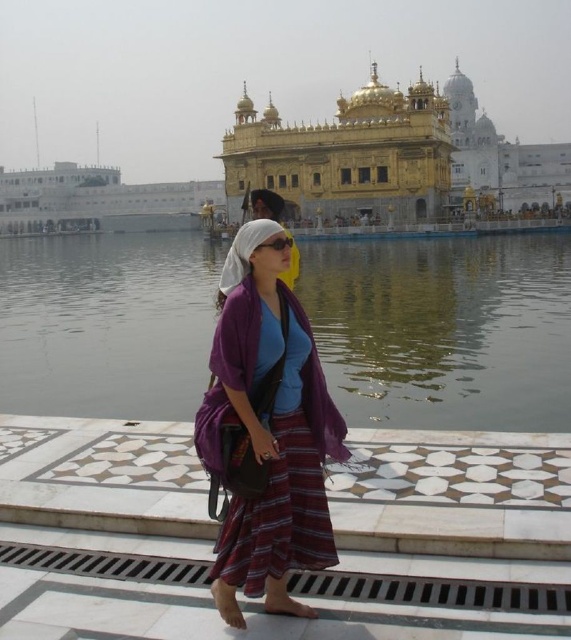
You are a visitor at the Golden Temple and notice the transparent water at center and the purple fabric scarf at center. Which object is taller when viewed from your perspective?

The transparent water at center is taller than the purple fabric scarf at center.

You are a visitor at the Golden Temple and want to take a photo of the purple fabric scarf at center and the transparent water at center. Which object should you focus on first if you want to capture both in a single frame without moving the camera?

The transparent water at center is bigger than the purple fabric scarf at center, so you should focus on the transparent water at center first to ensure it is clearly captured in the frame.

You are a visitor at the Golden Temple and want to ensure your purple fabric scarf at center stays dry while walking near the transparent water at center. Based on the scene, is there a risk of the scarf getting wet from the water?

The transparent water at center is located above the purple fabric scarf at center, meaning the water is positioned higher than the scarf. However, since the water is part of the sacred pool surrounding the temple and the scarf is on the woman, there is no direct contact. The scarf should remain dry as long as it isn not submerged into the water.